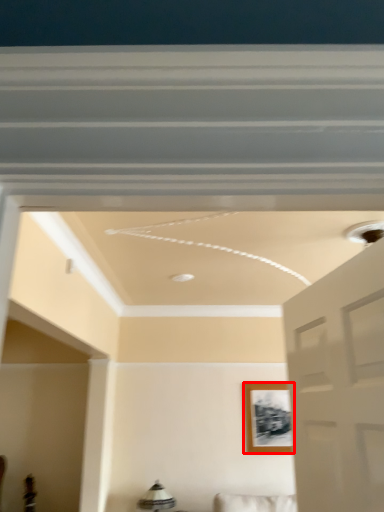
Question: From the image, what is the correct spatial relationship of picture frame (annotated by the red box) in relation to lamp?

Choices:
 (A) right
 (B) left

Answer: (A)